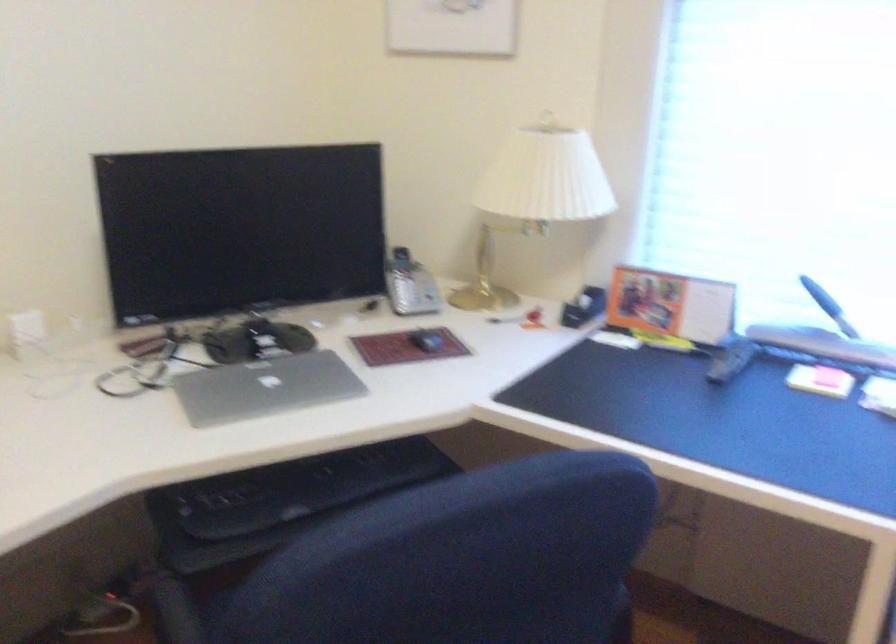
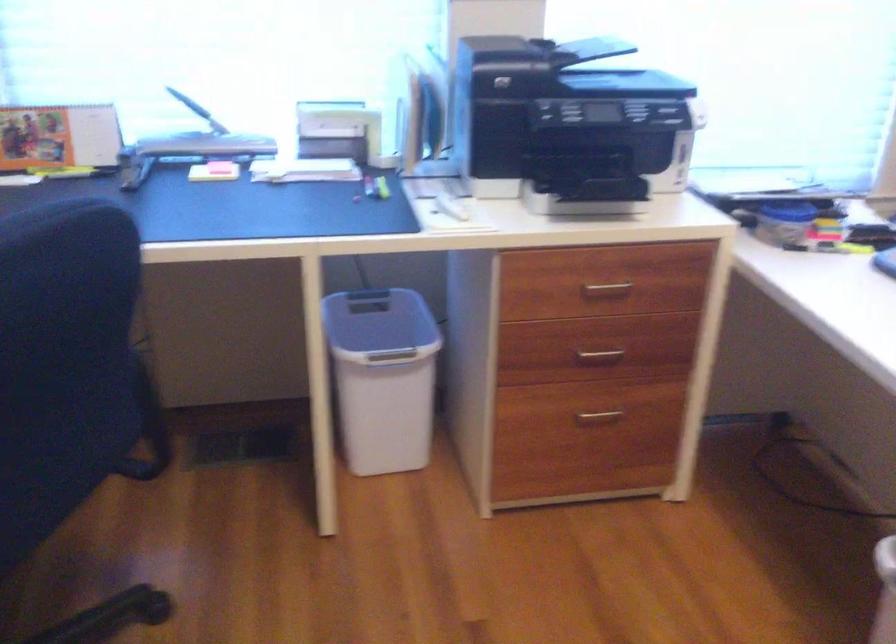
Question: The first image is from the beginning of the video and the second image is from the end. How did the camera likely rotate when shooting the video?

Choices:
 (A) Left
 (B) Right
 (C) Up
 (D) Down

Answer: (B)